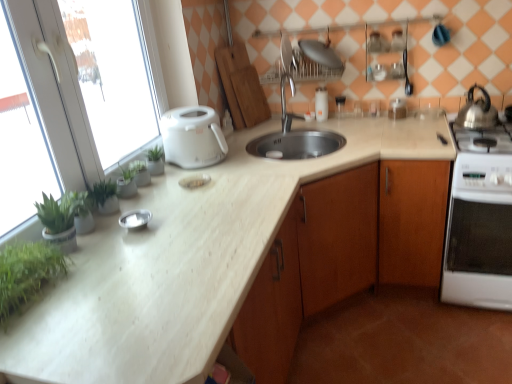
Locate an element on the screen. The image size is (512, 384). vacant area situated below metallic silver plate at upper center, which ranks as the second appliance in left-to-right order (from a real-world perspective) is located at coordinates (321, 120).